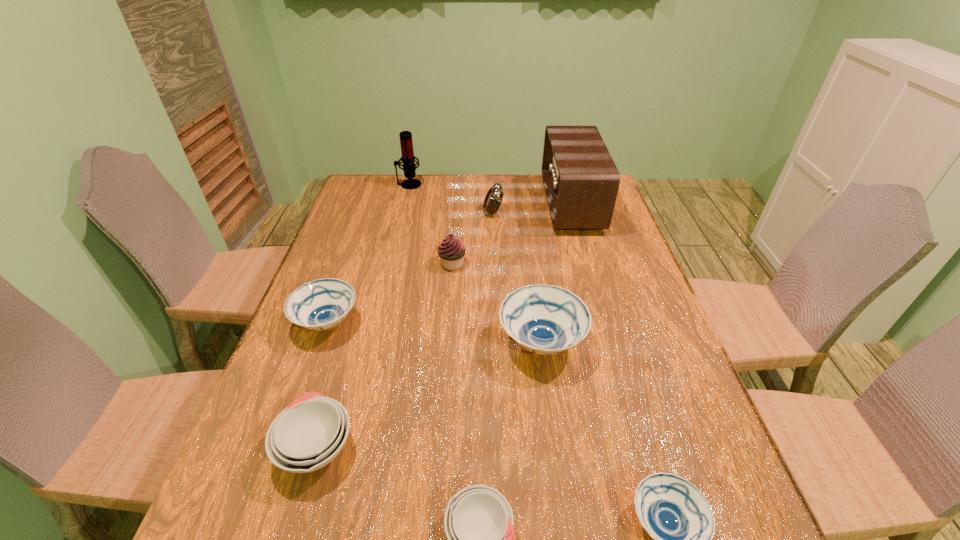
In order to click on radio receiver in this screenshot , I will do `click(581, 181)`.

Find the location of a particular element. The image size is (960, 540). microphone is located at coordinates (408, 159).

Find the location of a particular element. alarm clock is located at coordinates (493, 199).

In order to click on cupcake in this screenshot , I will do `click(451, 250)`.

This screenshot has width=960, height=540. I want to click on the fourth farthest object, so click(x=451, y=250).

Locate an element on the screen. the second blue soup bowl from left to right is located at coordinates (544, 319).

Where is `the fifth shortest object`? the fifth shortest object is located at coordinates (544, 319).

Where is `the leftmost blue soup bowl`? the leftmost blue soup bowl is located at coordinates (322, 304).

Locate an element on the screen. Image resolution: width=960 pixels, height=540 pixels. the farther white soup bowl is located at coordinates (307, 435).

Locate an element on the screen. the left white soup bowl is located at coordinates (307, 435).